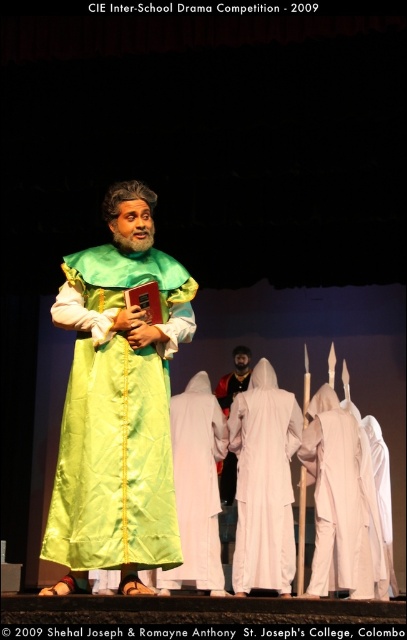
Who is shorter, green satin robe at center or white matte robe at center?

With less height is white matte robe at center.

Is green satin robe at center taller than white matte robe at center?

Yes.

Identify the location of green satin robe at center. (118, 404).

Who is shorter, green satin robe at center or white silk robe at center?

Standing shorter between the two is white silk robe at center.

Is green satin robe at center positioned behind white silk robe at center?

No, green satin robe at center is in front of white silk robe at center.

In order to click on green satin robe at center in this screenshot , I will do point(118,404).

What do you see at coordinates (341, 500) in the screenshot?
I see `white matte robe at center` at bounding box center [341, 500].

Which is more to the right, white matte robe at center or white cotton robe at center?

From the viewer's perspective, white matte robe at center appears more on the right side.

Which is in front, point (374, 563) or point (201, 371)?

Point (374, 563)

Locate an element on the screen. This screenshot has width=407, height=640. white matte robe at center is located at coordinates (341, 500).